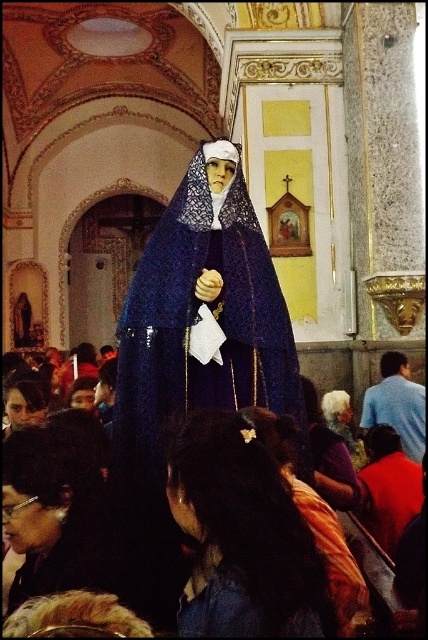
You are standing in the church and want to take a closer look at both the dark brown hair at center and the matte black hair at lower left. Which one would you need to walk towards first to reach the closer one first?

The dark brown hair at center is closer to the viewer than the matte black hair at lower left, so you should walk towards the dark brown hair at center first to reach the closer one first.

You are standing in the church and notice the statue at the center. Which object is closer to you between the white fabric headscarf at center and the gray hair at center?

The white fabric headscarf at center is closer to you because it is in front of the gray hair at center.